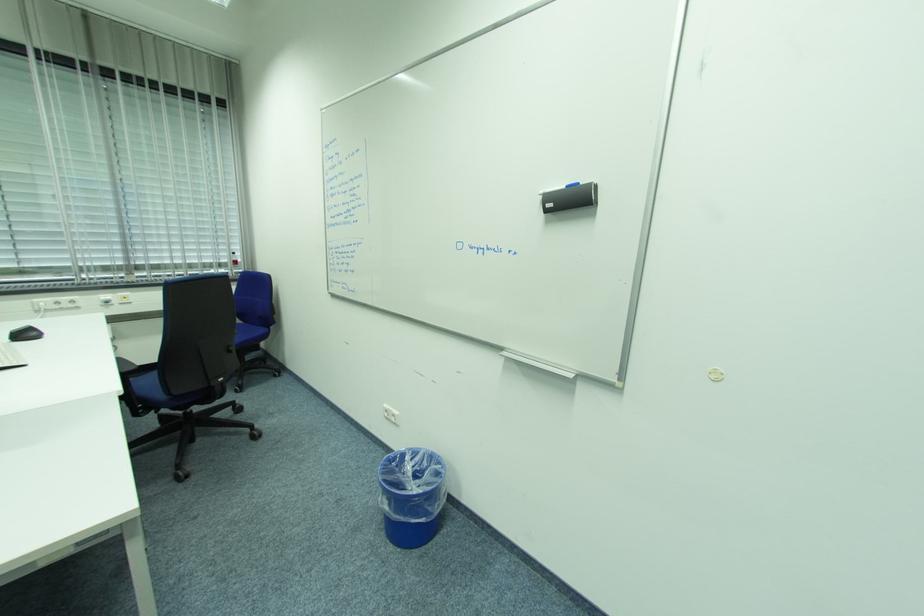
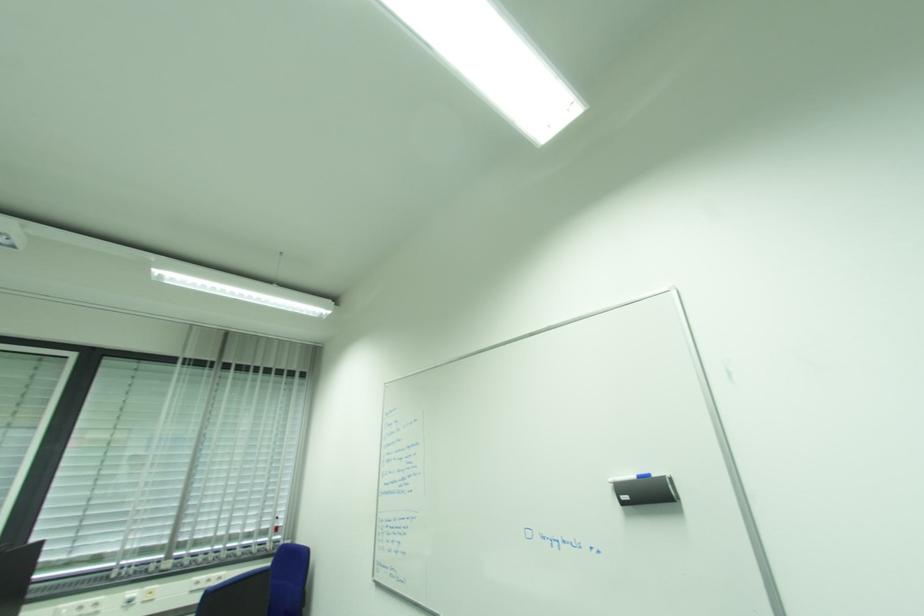
Question: The images are taken continuously from a first-person perspective. In which direction is your viewpoint rotating?

Choices:
 (A) Left
 (B) Right
 (C) Up
 (D) Down

Answer: (C)